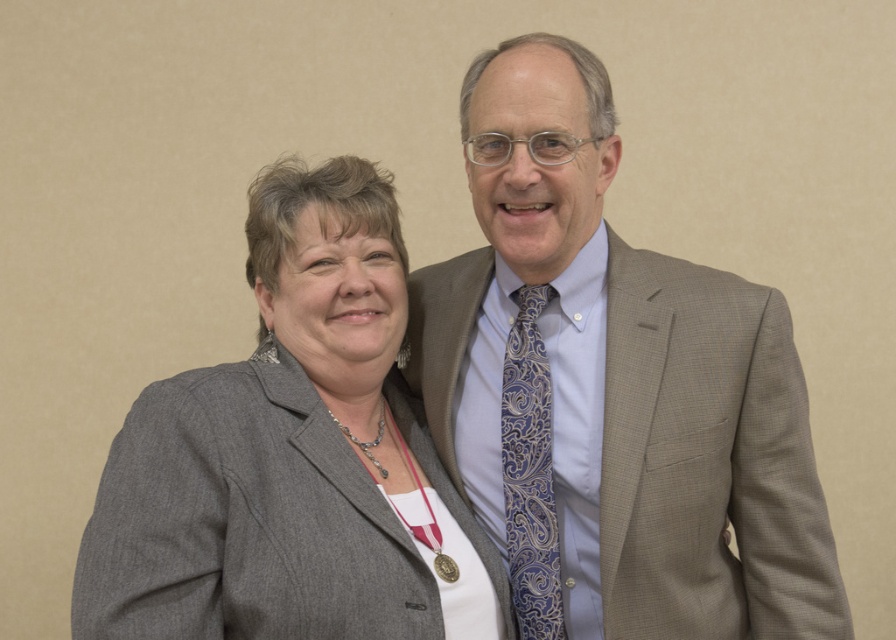
Question: Which of these objects is positioned farthest from the gray textured suit at center?

Choices:
 (A) gray wool blazer at center
 (B) blue paisley tie at center

Answer: (A)

Question: Does gray textured suit at center have a larger size compared to gray wool blazer at center?

Choices:
 (A) no
 (B) yes

Answer: (B)

Question: Is gray wool blazer at center thinner than blue paisley tie at center?

Choices:
 (A) yes
 (B) no

Answer: (B)

Question: Does gray wool blazer at center have a lesser width compared to blue paisley tie at center?

Choices:
 (A) no
 (B) yes

Answer: (A)

Question: Which object is positioned closest to the gray textured suit at center?

Choices:
 (A) blue paisley tie at center
 (B) gray wool blazer at center

Answer: (A)

Question: Among these objects, which one is farthest from the camera?

Choices:
 (A) gray wool blazer at center
 (B) blue paisley tie at center

Answer: (B)